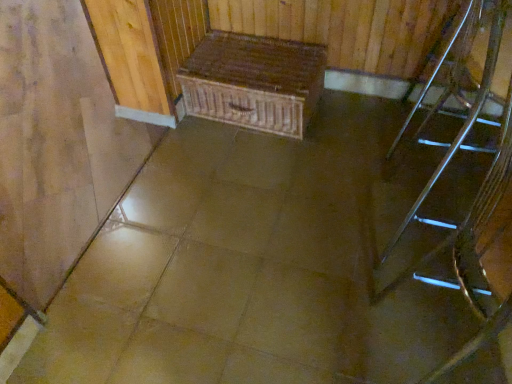
Where is `vacant space that is in between metallic silver chair at right and wooden chest at center`? vacant space that is in between metallic silver chair at right and wooden chest at center is located at coordinates point(358,126).